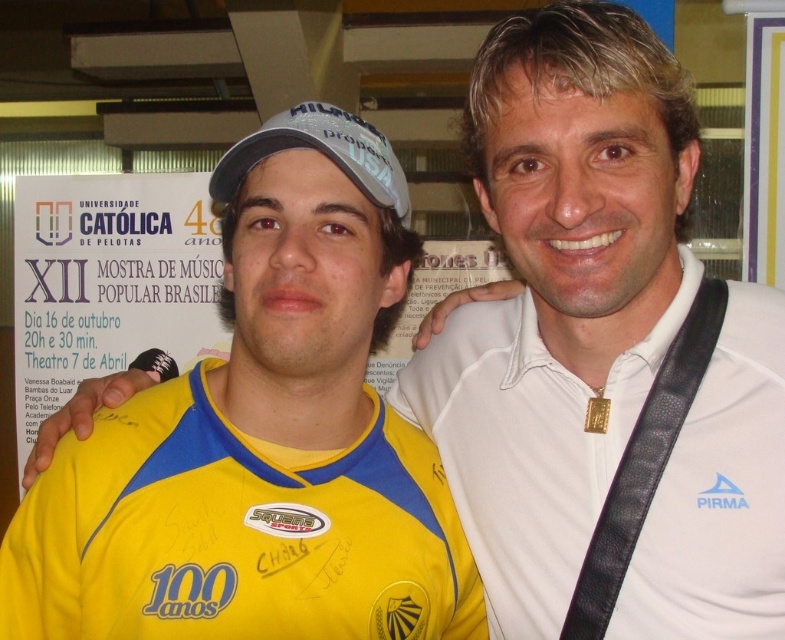
Which of these two, white matte polo shirt at center or white matte baseball cap at center, stands shorter?

white matte baseball cap at center is shorter.

Does white matte polo shirt at center have a larger size compared to white matte baseball cap at center?

Yes, white matte polo shirt at center is bigger than white matte baseball cap at center.

Where is `white matte polo shirt at center`? The height and width of the screenshot is (640, 785). white matte polo shirt at center is located at coordinates (526, 445).